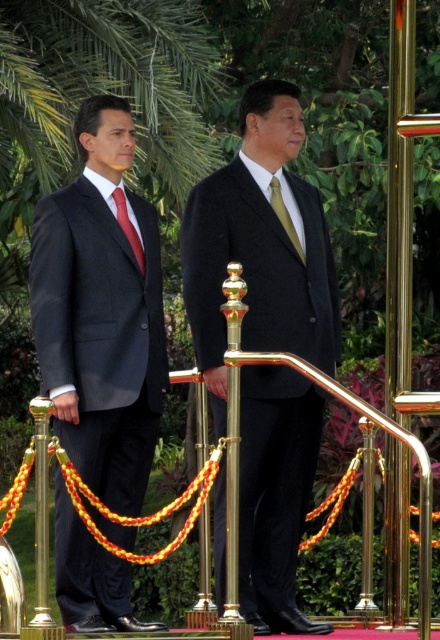
The image size is (440, 640). What do you see at coordinates (128, 227) in the screenshot?
I see `red satin tie at left` at bounding box center [128, 227].

Is the position of red satin tie at left less distant than that of gold silk tie at center?

No, it is behind gold silk tie at center.

You are a GUI agent. You are given a task and a screenshot of the screen. Output one action in this format:
    pyautogui.click(x=<x>, y=<y>)
    Task: Click on the red satin tie at left
    The image size is (440, 640).
    Given the screenshot: What is the action you would take?
    pyautogui.click(x=128, y=227)

The width and height of the screenshot is (440, 640). What are the coordinates of `red satin tie at left` in the screenshot? It's located at (128, 227).

What do you see at coordinates (260, 248) in the screenshot? I see `black matte suit at center` at bounding box center [260, 248].

Can you confirm if black matte suit at center is shorter than gold polished metal railing at center?

No.

Between point (206, 284) and point (362, 564), which one is positioned behind?

Point (362, 564)

Find the location of a particular element. This screenshot has height=640, width=440. black matte suit at center is located at coordinates (260, 248).

Does black matte suit at center have a greater height compared to red satin tie at left?

Yes, black matte suit at center is taller than red satin tie at left.

Is point (275, 106) farther from viewer compared to point (120, 216)?

Yes, it is behind point (120, 216).

This screenshot has width=440, height=640. Describe the element at coordinates (260, 248) in the screenshot. I see `black matte suit at center` at that location.

Locate an element on the screen. This screenshot has height=640, width=440. black matte suit at center is located at coordinates (260, 248).